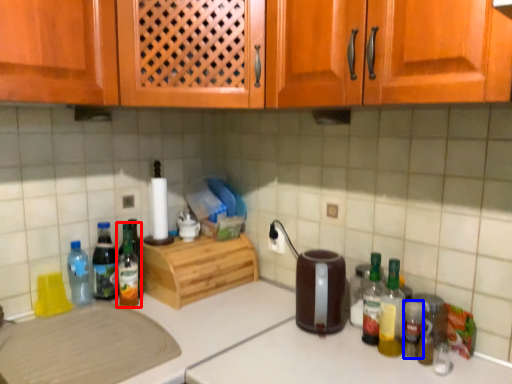
Question: Which of the following is the closest to the observer, bottle (highlighted by a red box) or bottle (highlighted by a blue box)?

Choices:
 (A) bottle
 (B) bottle

Answer: (B)